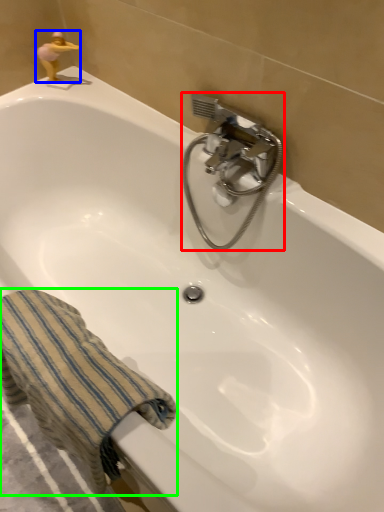
Question: Which object is positioned closest to plumbing fixture (highlighted by a red box)? Select from miniature (highlighted by a blue box) and towel/napkin (highlighted by a green box).

Choices:
 (A) miniature
 (B) towel/napkin

Answer: (B)